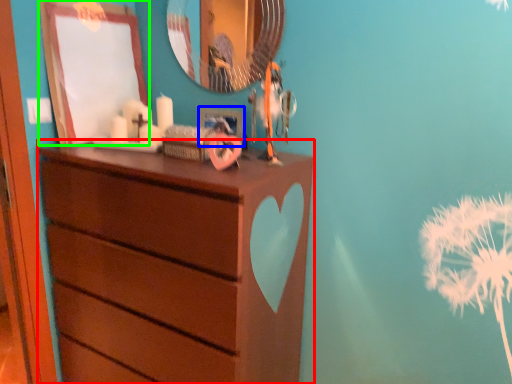
Question: Estimate the real-world distances between objects in this image. Which object is closer to chest of drawers (highlighted by a red box), picture frame (highlighted by a blue box) or picture frame (highlighted by a green box)?

Choices:
 (A) picture frame
 (B) picture frame

Answer: (B)